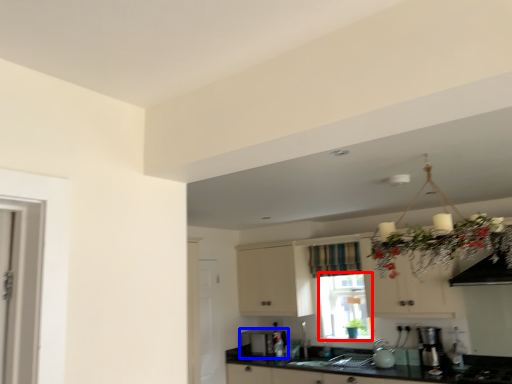
Question: Which object is closer to the camera taking this photo, window screen (highlighted by a red box) or appliance (highlighted by a blue box)?

Choices:
 (A) window screen
 (B) appliance

Answer: (A)